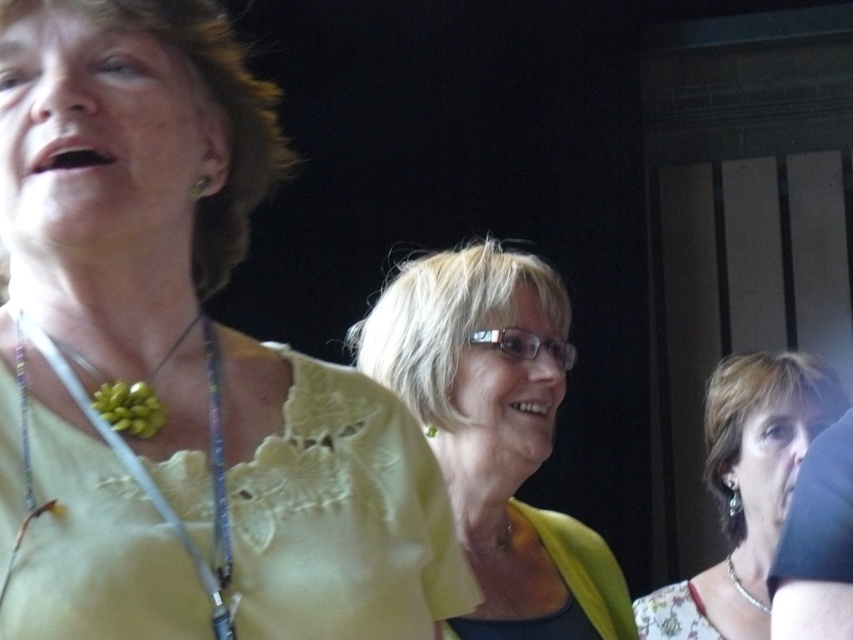
You are standing in the same room as the people in the image. You need to hand a gift to the person wearing the floral fabric dress at lower right but must avoid touching the silver metallic necklace at lower right. Which direction should you approach from?

You should approach from the left side of the floral fabric dress at lower right because the silver metallic necklace at lower right is to the right of it, so approaching from the left would avoid contact with the necklace.